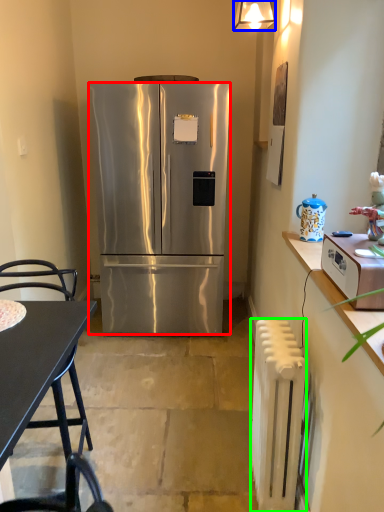
Question: Based on their relative distances, which object is farther from refrigerator (highlighted by a red box)? Choose from lamp (highlighted by a blue box) and radiator (highlighted by a green box).

Choices:
 (A) lamp
 (B) radiator

Answer: (B)